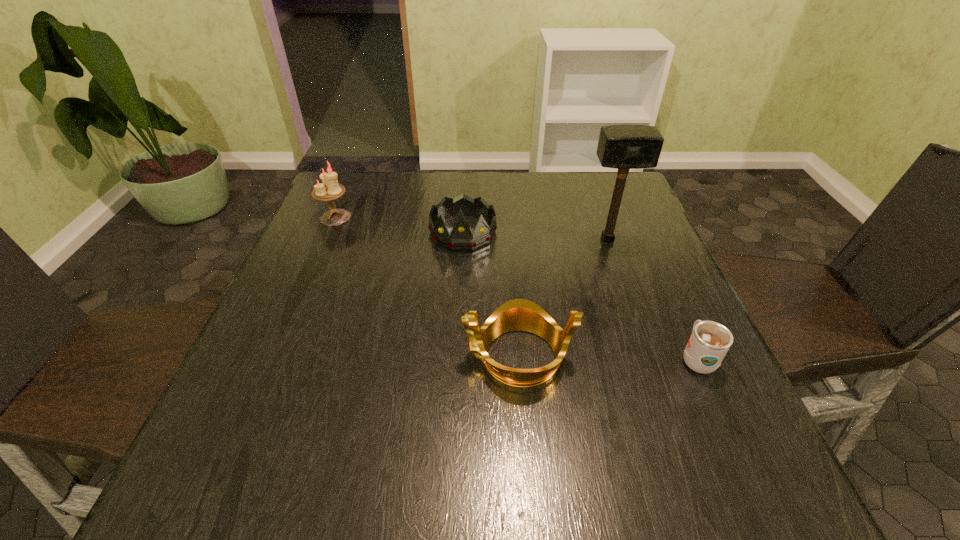
The image size is (960, 540). Identify the location of free space located at the front emblem of the nearer tiara. (316, 356).

The image size is (960, 540). I want to click on vacant space located at the front emblem of the nearer tiara, so click(x=378, y=356).

Where is `vacant space situated 0.210m on the side with the handle of the cup`? The image size is (960, 540). vacant space situated 0.210m on the side with the handle of the cup is located at coordinates 657,269.

Where is `blank space located on the side with the handle of the cup`? The height and width of the screenshot is (540, 960). blank space located on the side with the handle of the cup is located at coordinates (638, 228).

I want to click on vacant space located on the side with the handle of the cup, so click(x=642, y=238).

Find the location of a particular element. candle holder present at the far edge is located at coordinates (330, 189).

Locate an element on the screen. tiara positioned at the far edge is located at coordinates (461, 238).

The width and height of the screenshot is (960, 540). Find the location of `object at the left edge`. object at the left edge is located at coordinates (330, 189).

At what (x,y) coordinates should I click in order to perform the action: click on mallet present at the right edge. Please return your answer as a coordinate pair (x, y). Looking at the image, I should click on (624, 147).

This screenshot has width=960, height=540. Find the location of `cup present at the right edge`. cup present at the right edge is located at coordinates coord(710,341).